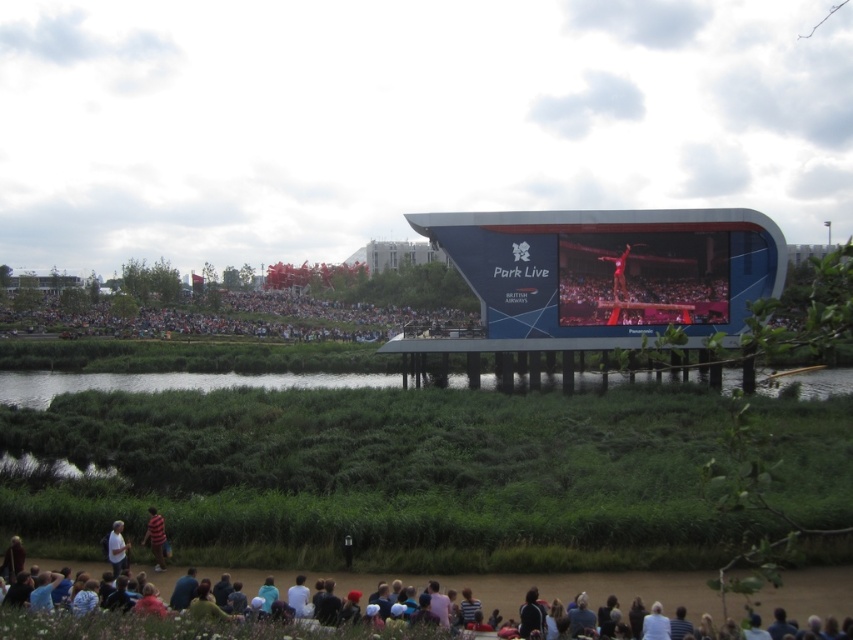
Does dark gray clothing at lower center have a greater width compared to white fabric shirt at lower left?

Yes.

Image resolution: width=853 pixels, height=640 pixels. Describe the element at coordinates (590, 589) in the screenshot. I see `dark gray clothing at lower center` at that location.

Where is `dark gray clothing at lower center`? The image size is (853, 640). dark gray clothing at lower center is located at coordinates (590, 589).

Locate an element on the screen. dark gray clothing at lower center is located at coordinates (590, 589).

Is point (393, 323) in front of point (115, 545)?

No, it is behind (115, 545).

Looking at this image, can you confirm if blue fabric crowd at center is wider than white fabric shirt at lower left?

Yes.

Is point (134, 333) less distant than point (111, 536)?

No, it is not.

You are a GUI agent. You are given a task and a screenshot of the screen. Output one action in this format:
    pyautogui.click(x=<x>, y=<y>)
    Task: Click on the blue fabric crowd at center
    This screenshot has height=640, width=853.
    Given the screenshot: What is the action you would take?
    pyautogui.click(x=227, y=316)

Does blue fabric crowd at center have a lesser height compared to striped shirt at lower center?

No.

Can you confirm if blue fabric crowd at center is taller than striped shirt at lower center?

Indeed, blue fabric crowd at center has a greater height compared to striped shirt at lower center.

At what (x,y) coordinates should I click in order to perform the action: click on blue fabric crowd at center. Please return your answer as a coordinate pair (x, y). This screenshot has height=640, width=853. Looking at the image, I should click on (227, 316).